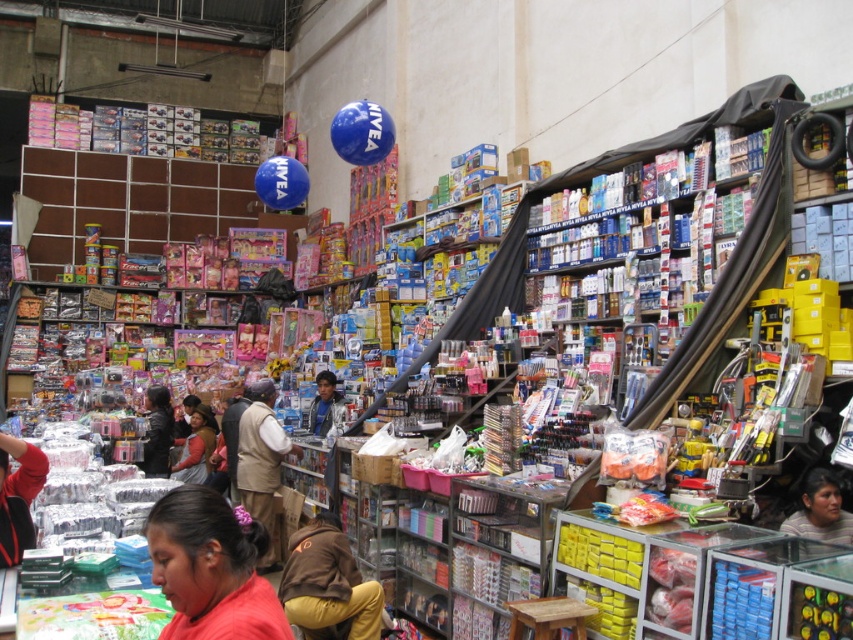
Is brown fabric vest at center below matte brown jacket at center?

Yes.

Is brown fabric vest at center shorter than matte brown jacket at center?

Correct, brown fabric vest at center is not as tall as matte brown jacket at center.

Is point (282, 440) closer to viewer compared to point (189, 454)?

Yes, it is.

Find the location of a particular element. brown fabric vest at center is located at coordinates (260, 460).

Which is more to the left, matte red shirt at lower left or matte brown jacket at center?

matte brown jacket at center

Which is in front, point (213, 616) or point (198, 456)?

Positioned in front is point (213, 616).

Locate an element on the screen. matte red shirt at lower left is located at coordinates (212, 568).

Is matte red shirt at lower left smaller than brown fabric vest at center?

No, matte red shirt at lower left is not smaller than brown fabric vest at center.

Is point (225, 605) behind point (253, 417)?

That is False.

In order to click on matte red shirt at lower left in this screenshot , I will do `click(212, 568)`.